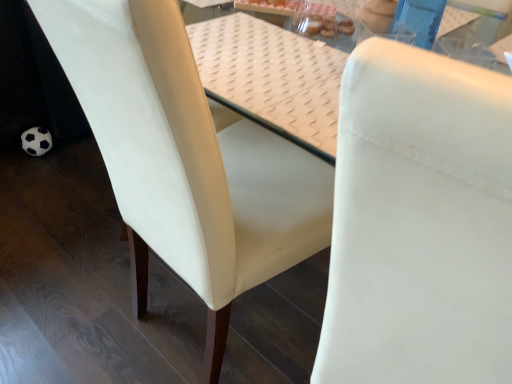
Question: Does white leather chair at center, the second chair positioned from the left, contain white textured table at center?

Choices:
 (A) no
 (B) yes

Answer: (A)

Question: Is the depth of white leather chair at center, the second chair positioned from the left, less than that of white textured table at center?

Choices:
 (A) no
 (B) yes

Answer: (B)

Question: Can you confirm if white leather chair at center, the second chair positioned from the left, is shorter than white textured table at center?

Choices:
 (A) yes
 (B) no

Answer: (B)

Question: From the image's perspective, would you say white leather chair at center, which is the 1th chair in right-to-left order, is shown under white textured table at center?

Choices:
 (A) no
 (B) yes

Answer: (B)

Question: Is the depth of white leather chair at center, which is the 1th chair in right-to-left order, greater than that of white textured table at center?

Choices:
 (A) no
 (B) yes

Answer: (A)

Question: From a real-world perspective, is white leather chair at center, the second chair positioned from the left, under white textured table at center?

Choices:
 (A) no
 (B) yes

Answer: (B)

Question: Is white leather chair at center, the second chair positioned from the left, looking in the opposite direction of white leather chair at center, placed as the 2th chair when sorted from right to left?

Choices:
 (A) no
 (B) yes

Answer: (A)

Question: Are white leather chair at center, the second chair positioned from the left, and white leather chair at center, acting as the 1th chair starting from the left, located far from each other?

Choices:
 (A) no
 (B) yes

Answer: (A)

Question: From a real-world perspective, is white leather chair at center, the second chair positioned from the left, on white leather chair at center, placed as the 2th chair when sorted from right to left?

Choices:
 (A) yes
 (B) no

Answer: (A)

Question: Is white leather chair at center, which is the 1th chair in right-to-left order, not inside white leather chair at center, placed as the 2th chair when sorted from right to left?

Choices:
 (A) no
 (B) yes

Answer: (B)

Question: Does white leather chair at center, which is the 1th chair in right-to-left order, turn towards white leather chair at center, placed as the 2th chair when sorted from right to left?

Choices:
 (A) yes
 (B) no

Answer: (B)

Question: Is white leather chair at center, the second chair positioned from the left, beside white leather chair at center, placed as the 2th chair when sorted from right to left?

Choices:
 (A) yes
 (B) no

Answer: (B)

Question: Is white textured table at center looking in the opposite direction of white leather chair at center, the second chair positioned from the left?

Choices:
 (A) no
 (B) yes

Answer: (A)